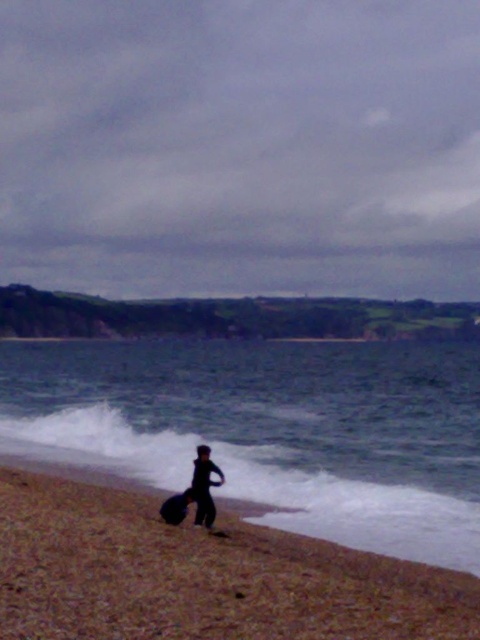
Question: Which point appears farthest from the camera in this image?

Choices:
 (A) (337, 561)
 (B) (167, 508)

Answer: (B)

Question: Is brown sandy beach at lower left thinner than black matte surfboard at lower center?

Choices:
 (A) no
 (B) yes

Answer: (B)

Question: Observing the image, what is the correct spatial positioning of blue water at lower center in reference to black matte surfboard at lower center?

Choices:
 (A) below
 (B) above

Answer: (A)

Question: Which of the following is the farthest from the observer?

Choices:
 (A) (166, 522)
 (B) (363, 464)

Answer: (B)

Question: Which object is closer to the camera taking this photo?

Choices:
 (A) black matte surfboard at lower center
 (B) blue water at lower center

Answer: (B)

Question: Does blue water at lower center have a greater width compared to black matte surfboard at lower center?

Choices:
 (A) yes
 (B) no

Answer: (A)